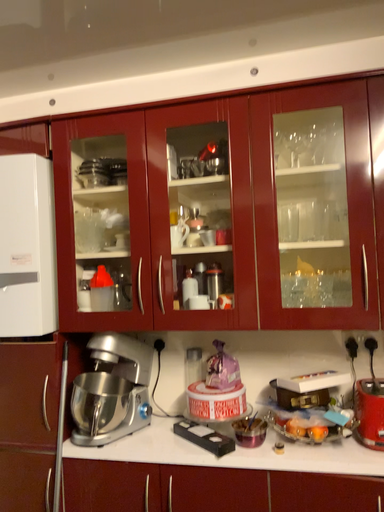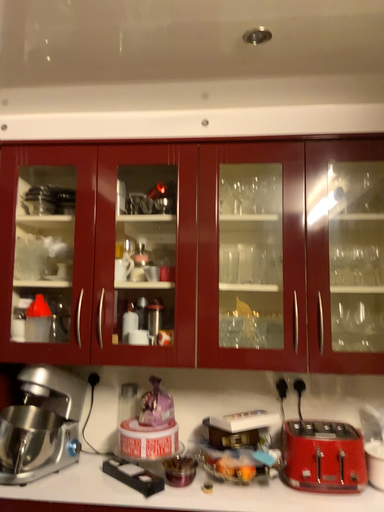
Question: How did the camera likely rotate when shooting the video?

Choices:
 (A) rotated right
 (B) rotated left

Answer: (A)